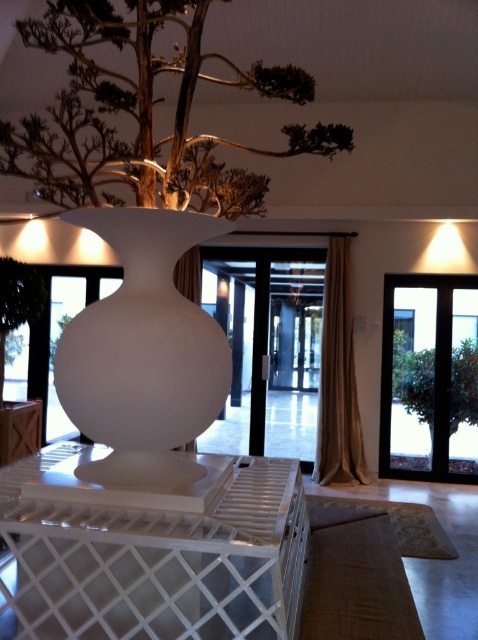
This screenshot has height=640, width=478. Describe the element at coordinates (144, 113) in the screenshot. I see `wooden textured bonsai tree at upper center` at that location.

Describe the element at coordinates (144, 113) in the screenshot. I see `wooden textured bonsai tree at upper center` at that location.

At what (x,y) coordinates should I click in order to perform the action: click on wooden textured bonsai tree at upper center. Please return your answer as a coordinate pair (x, y). The image size is (478, 640). Looking at the image, I should click on (144, 113).

Who is positioned more to the right, wooden textured bonsai tree at upper center or black glass door at right?

From the viewer's perspective, black glass door at right appears more on the right side.

Is point (196, 64) less distant than point (390, 301)?

Yes, point (196, 64) is in front of point (390, 301).

Is point (322, 156) farther from camera compared to point (391, 394)?

No, it is not.

Where is `wooden textured bonsai tree at upper center`? wooden textured bonsai tree at upper center is located at coordinates (144, 113).

Is white matte vase at center positioned behind black glass door at right?

No.

Which is behind, point (83, 314) or point (457, 364)?

The point (457, 364) is more distant.

At what (x,y) coordinates should I click in order to perform the action: click on white matte vase at center. Please return your answer as a coordinate pair (x, y). Looking at the image, I should click on (143, 353).